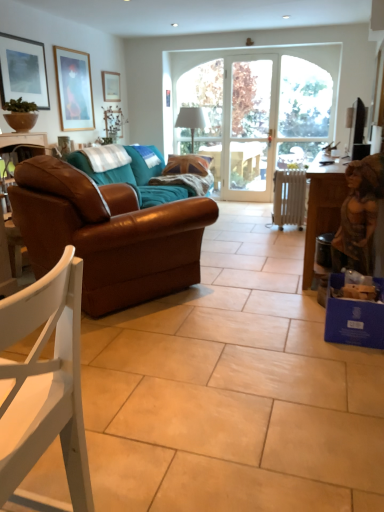
Question: Is wooden picture frame at upper left, acting as the 2th picture frame starting from the right, next to white matte chair at lower left and touching it?

Choices:
 (A) no
 (B) yes

Answer: (A)

Question: Would you say wooden picture frame at upper left, acting as the 2th picture frame starting from the right, is outside white matte chair at lower left?

Choices:
 (A) yes
 (B) no

Answer: (A)

Question: Considering the relative positions of wooden picture frame at upper left, placed as the second picture frame when sorted from front to back, and white matte chair at lower left in the image provided, is wooden picture frame at upper left, placed as the second picture frame when sorted from front to back, to the right of white matte chair at lower left from the viewer's perspective?

Choices:
 (A) yes
 (B) no

Answer: (B)

Question: Does wooden picture frame at upper left, the 2th picture frame from the left, turn towards white matte chair at lower left?

Choices:
 (A) no
 (B) yes

Answer: (A)

Question: Does wooden picture frame at upper left, the 2th picture frame from the left, lie behind white matte chair at lower left?

Choices:
 (A) yes
 (B) no

Answer: (A)

Question: From the image's perspective, does wooden picture frame at upper left, placed as the second picture frame when sorted from front to back, appear higher than white matte chair at lower left?

Choices:
 (A) no
 (B) yes

Answer: (B)

Question: Is matte black television at upper right wider than white matte chair at lower left?

Choices:
 (A) yes
 (B) no

Answer: (B)

Question: Is matte black television at upper right not inside white matte chair at lower left?

Choices:
 (A) yes
 (B) no

Answer: (A)

Question: Considering the relative positions of matte black television at upper right and white matte chair at lower left in the image provided, is matte black television at upper right behind white matte chair at lower left?

Choices:
 (A) no
 (B) yes

Answer: (B)

Question: Does matte black television at upper right appear on the right side of white matte chair at lower left?

Choices:
 (A) no
 (B) yes

Answer: (B)

Question: Is matte black television at upper right at the left side of white matte chair at lower left?

Choices:
 (A) no
 (B) yes

Answer: (A)

Question: Does matte black television at upper right contain white matte chair at lower left?

Choices:
 (A) no
 (B) yes

Answer: (A)

Question: Is wooden picture frame at upper left, placed as the second picture frame when sorted from front to back, taller than wooden table at right?

Choices:
 (A) no
 (B) yes

Answer: (B)